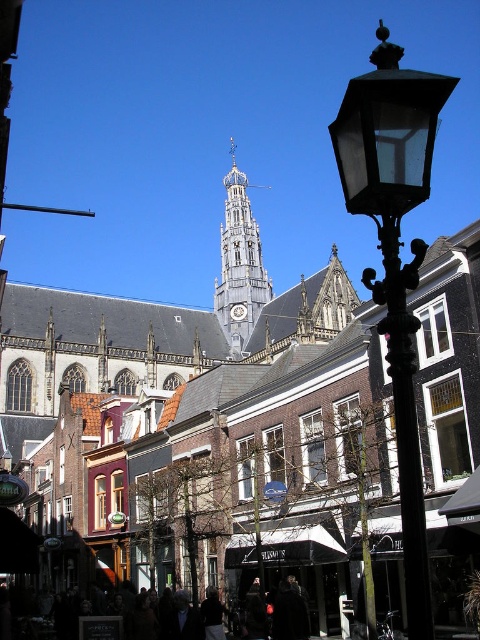
Does wooden spire at center appear over dark clothing at lower center?

→ Indeed, wooden spire at center is positioned over dark clothing at lower center.

Is wooden spire at center further to the viewer compared to dark clothing at lower center?

Yes, wooden spire at center is further from the viewer.

At what (x,y) coordinates should I click in order to perform the action: click on wooden spire at center. Please return your answer as a coordinate pair (x, y). This screenshot has height=640, width=480. Looking at the image, I should click on (240, 262).

Is matte black street lamp at right positioned behind wooden spire at center?

No.

Does point (348, 145) lie behind point (227, 209)?

No, (348, 145) is in front of (227, 209).

You are a GUI agent. You are given a task and a screenshot of the screen. Output one action in this format:
    pyautogui.click(x=<x>, y=<y>)
    Task: Click on the matte black street lamp at right
    This screenshot has width=480, height=640.
    Given the screenshot: What is the action you would take?
    pyautogui.click(x=395, y=253)

Which is below, wooden spire at center or metallic clock at center?

metallic clock at center is below.

Who is more forward, (226, 248) or (240, 310)?

Point (240, 310) is more forward.

At what (x,y) coordinates should I click in order to perform the action: click on wooden spire at center. Please return your answer as a coordinate pair (x, y). The height and width of the screenshot is (640, 480). Looking at the image, I should click on (240, 262).